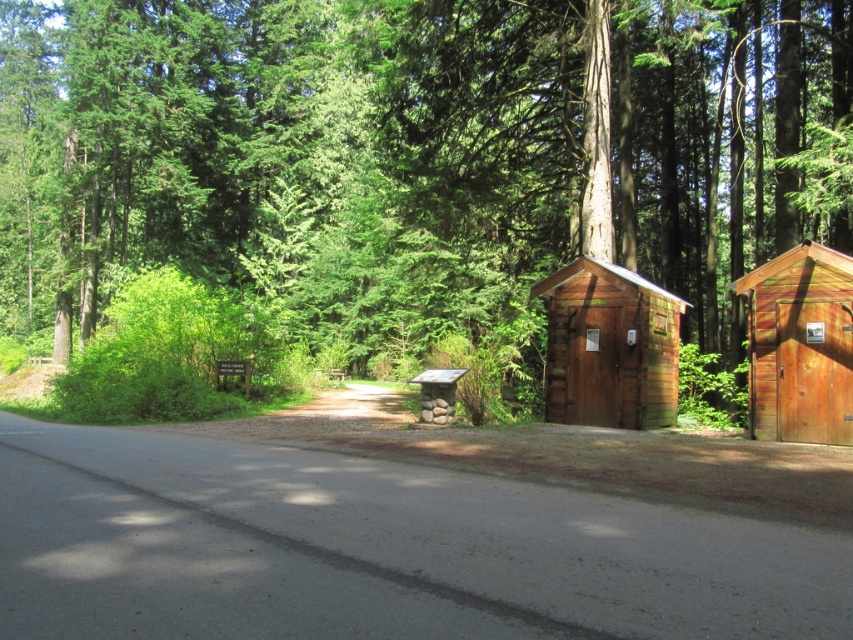
You are planning to park a large delivery truck that is 3 meters wide. You see the wooden cabin at center and the wooden cabin at right. Which cabin can the truck park next to without overlapping?

The wooden cabin at center might be wider than wooden cabin at right, so the truck can park next to the wooden cabin at center since it is wider and provides more space.

You are a hiker who needs to set up a tent between the brown wooden shed at right and the wooden cabin at right. What is the minimum distance you need to keep between the tent and each structure to ensure it is placed exactly halfway between them?

The brown wooden shed at right and wooden cabin at right are 21.25 meters apart. To place the tent exactly halfway between them, you need to keep a minimum distance of 10.625 meters from each structure.

You are a hiker who wants to reach the wooden cabin at center from the road. The brown wooden shed at right is blocking your path. Can you walk around it to get to the cabin?

The brown wooden shed at right is above the wooden cabin at center, so it is positioned higher up and not directly blocking the path. You can walk around it to reach the cabin.